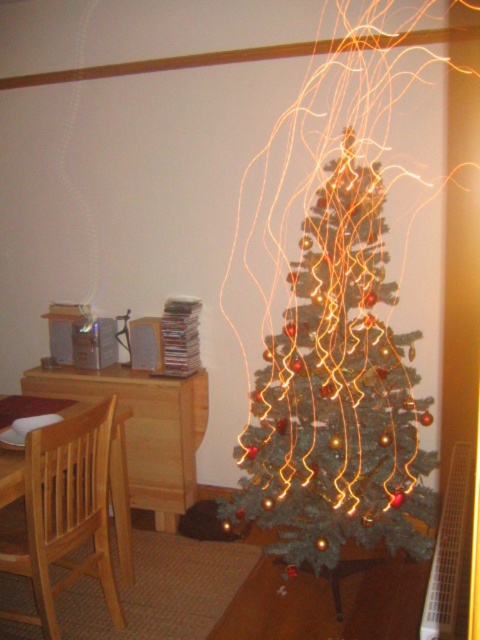
Question: Which object is farther from the camera taking this photo?

Choices:
 (A) light wood table at left
 (B) light brown wooden chair at left

Answer: (A)

Question: Does light brown wooden chair at left appear over light wood table at left?

Choices:
 (A) yes
 (B) no

Answer: (B)

Question: Is green matte christmas tree at center further to camera compared to light wood table at left?

Choices:
 (A) yes
 (B) no

Answer: (B)

Question: Which object appears closest to the camera in this image?

Choices:
 (A) green matte christmas tree at center
 (B) light brown wooden chair at left

Answer: (B)

Question: In this image, where is green matte christmas tree at center located relative to light wood table at left?

Choices:
 (A) below
 (B) above

Answer: (B)

Question: Which object is the farthest from the light brown wooden chair at left?

Choices:
 (A) light wood table at left
 (B) green matte christmas tree at center

Answer: (B)